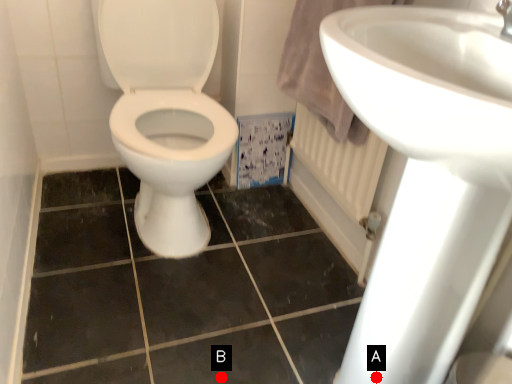
Question: Two points are circled on the image, labeled by A and B beside each circle. Which point is closer to the camera taking this photo?

Choices:
 (A) A is closer
 (B) B is closer

Answer: (A)